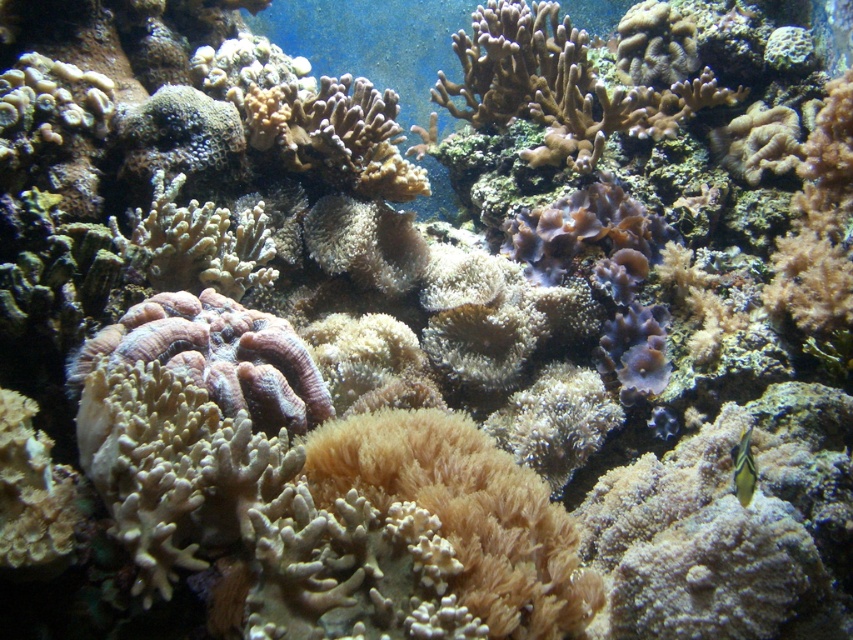
The width and height of the screenshot is (853, 640). Describe the element at coordinates (216, 356) in the screenshot. I see `purple coral at center` at that location.

Describe the element at coordinates (216, 356) in the screenshot. I see `purple coral at center` at that location.

Identify the location of purple coral at center. This screenshot has width=853, height=640. (216, 356).